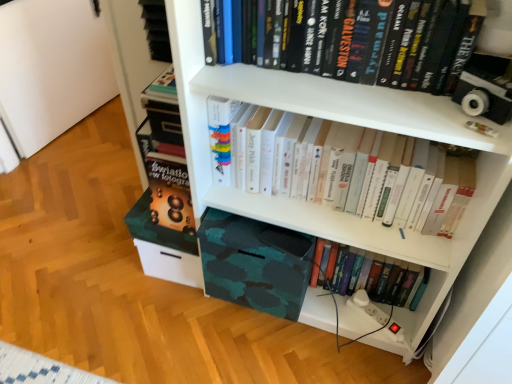
Question: Is camo fabric box at lower center thinner than hardcover book at lower center, which is counted as the first book, starting from the bottom?

Choices:
 (A) yes
 (B) no

Answer: (B)

Question: Is camo fabric box at lower center positioned behind hardcover book at lower center, which is counted as the first book, starting from the bottom?

Choices:
 (A) no
 (B) yes

Answer: (A)

Question: Would you say camo fabric box at lower center is a long distance from hardcover book at lower center, the 3th book when ordered from top to bottom?

Choices:
 (A) no
 (B) yes

Answer: (A)

Question: Is camo fabric box at lower center wider than hardcover book at lower center, which is counted as the first book, starting from the bottom?

Choices:
 (A) yes
 (B) no

Answer: (A)

Question: Considering the relative sizes of camo fabric box at lower center and hardcover book at lower center, which is counted as the first book, starting from the bottom, in the image provided, is camo fabric box at lower center shorter than hardcover book at lower center, which is counted as the first book, starting from the bottom,?

Choices:
 (A) no
 (B) yes

Answer: (A)

Question: Is hardcover book at lower center, the 3th book when ordered from top to bottom, at the back of camo fabric box at lower center?

Choices:
 (A) no
 (B) yes

Answer: (A)

Question: From a real-world perspective, is hardcover book at lower center, the 3th book when ordered from top to bottom, positioned over camo fabric box at lower center based on gravity?

Choices:
 (A) yes
 (B) no

Answer: (B)

Question: Is hardcover book at lower center, which is counted as the first book, starting from the bottom, outside of camo fabric box at lower center?

Choices:
 (A) yes
 (B) no

Answer: (A)

Question: Does hardcover book at lower center, which is counted as the first book, starting from the bottom, lie behind camo fabric box at lower center?

Choices:
 (A) yes
 (B) no

Answer: (A)

Question: Considering the relative positions of hardcover book at lower center, the 3th book when ordered from top to bottom, and camo fabric box at lower center in the image provided, is hardcover book at lower center, the 3th book when ordered from top to bottom, to the left of camo fabric box at lower center from the viewer's perspective?

Choices:
 (A) yes
 (B) no

Answer: (B)

Question: Does hardcover book at lower center, the 3th book when ordered from top to bottom, have a greater height compared to camo fabric box at lower center?

Choices:
 (A) yes
 (B) no

Answer: (B)

Question: From the image's perspective, is hardcover book at lower center, which is counted as the first book, starting from the bottom, over camo fabric box at lower center?

Choices:
 (A) no
 (B) yes

Answer: (A)

Question: Is hardcover books at upper center, which appears as the 1th book when viewed from the top, far from camo fabric box at lower center?

Choices:
 (A) no
 (B) yes

Answer: (A)